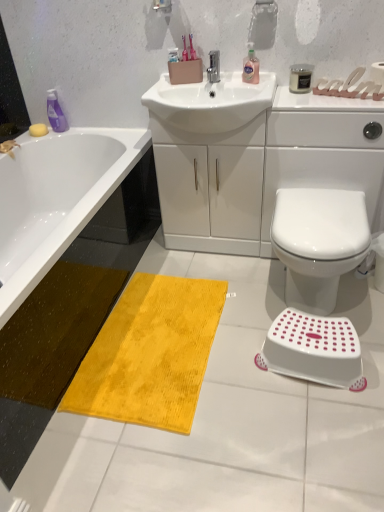
Find the location of a particular element. This screenshot has height=512, width=384. vacant space to the right of yellow plush bath mat at center is located at coordinates (260, 345).